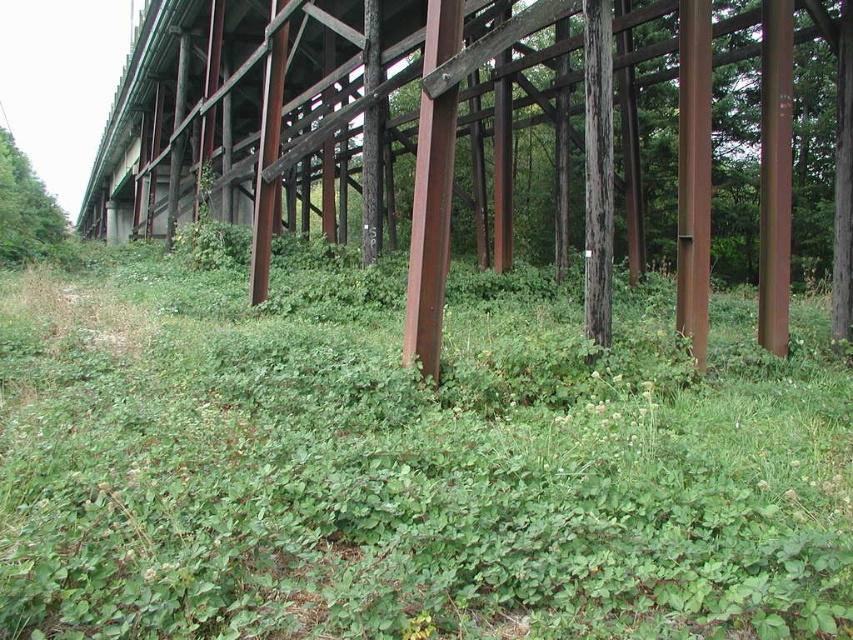
Question: Does rusty metal bridge at center have a greater width compared to green leafy tree at upper left?

Choices:
 (A) no
 (B) yes

Answer: (B)

Question: Which point is farther to the camera?

Choices:
 (A) green leafy grass at center
 (B) green leafy tree at upper left
 (C) rusty metal bridge at center

Answer: (B)

Question: Which of the following is the farthest from the observer?

Choices:
 (A) (781, 600)
 (B) (120, 141)
 (C) (0, 145)

Answer: (C)

Question: Which of the following is the farthest from the observer?

Choices:
 (A) green leafy grass at center
 (B) rusty metal bridge at center
 (C) green leafy tree at upper left

Answer: (C)

Question: Does rusty metal bridge at center lie in front of green leafy tree at upper left?

Choices:
 (A) yes
 (B) no

Answer: (A)

Question: Is green leafy grass at center positioned behind rusty metal bridge at center?

Choices:
 (A) yes
 (B) no

Answer: (B)